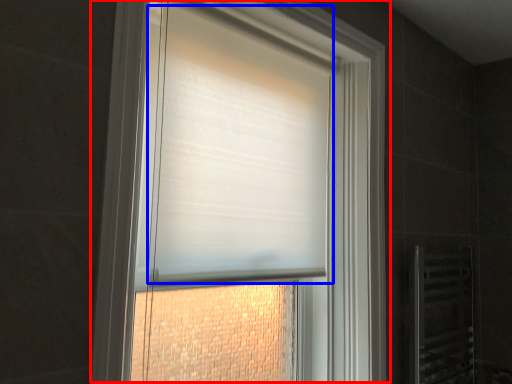
Question: Which object appears closest to the camera in this image, window (highlighted by a red box) or blind (highlighted by a blue box)?

Choices:
 (A) window
 (B) blind

Answer: (A)